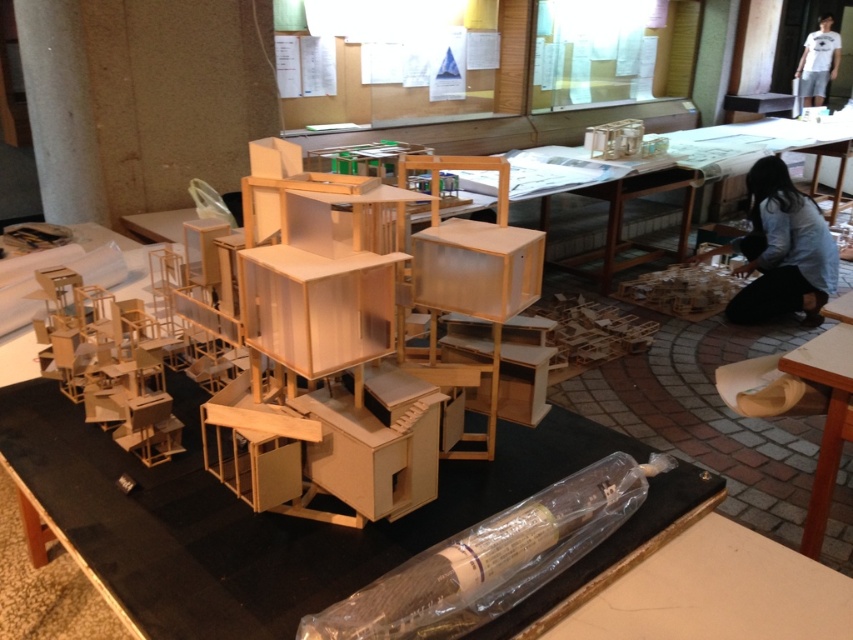
Question: Among these points, which one is farthest from the camera?

Choices:
 (A) (784, 193)
 (B) (802, 356)

Answer: (A)

Question: Which point is farther to the camera?

Choices:
 (A) light blue shirt at lower right
 (B) wooden table at lower right

Answer: (A)

Question: Can you confirm if light blue shirt at lower right is smaller than wooden table at lower right?

Choices:
 (A) no
 (B) yes

Answer: (A)

Question: Considering the real-world distances, which object is farthest from the white cotton t-shirt at upper right?

Choices:
 (A) light blue shirt at lower right
 (B) wooden table at lower right

Answer: (B)

Question: Is light blue shirt at lower right wider than wooden table at lower right?

Choices:
 (A) no
 (B) yes

Answer: (B)

Question: Is light blue shirt at lower right in front of wooden table at lower right?

Choices:
 (A) no
 (B) yes

Answer: (A)